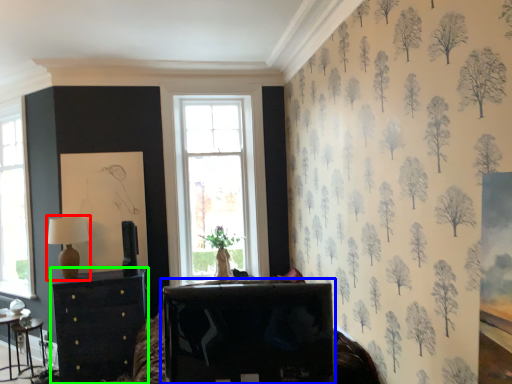
Question: Which is farther away from table lamp (highlighted by a red box)? table (highlighted by a blue box) or chest of drawers (highlighted by a green box)?

Choices:
 (A) table
 (B) chest of drawers

Answer: (A)